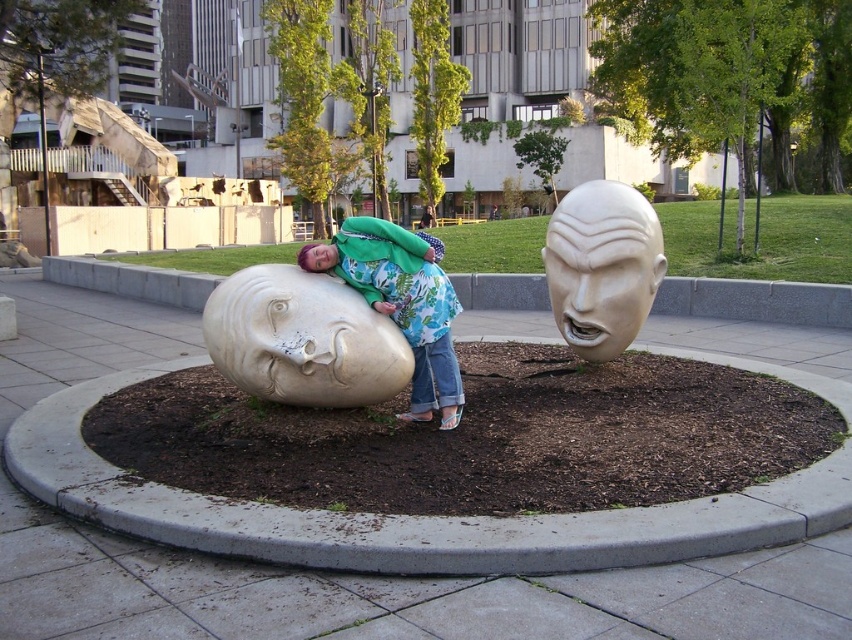
Question: Which object is the farthest from the matte green jacket at center?

Choices:
 (A) matte white stone head at center
 (B) white marble head at upper right

Answer: (B)

Question: Estimate the real-world distances between objects in this image. Which object is farther from the matte white stone head at center?

Choices:
 (A) matte green jacket at center
 (B) white marble head at upper right

Answer: (B)

Question: Which object is farther from the camera taking this photo?

Choices:
 (A) matte green jacket at center
 (B) matte white stone head at center

Answer: (A)

Question: Is white marble head at upper right smaller than matte green jacket at center?

Choices:
 (A) no
 (B) yes

Answer: (A)

Question: Does matte white stone head at center appear on the left side of matte green jacket at center?

Choices:
 (A) yes
 (B) no

Answer: (A)

Question: Can you confirm if matte white stone head at center is positioned below matte green jacket at center?

Choices:
 (A) no
 (B) yes

Answer: (B)